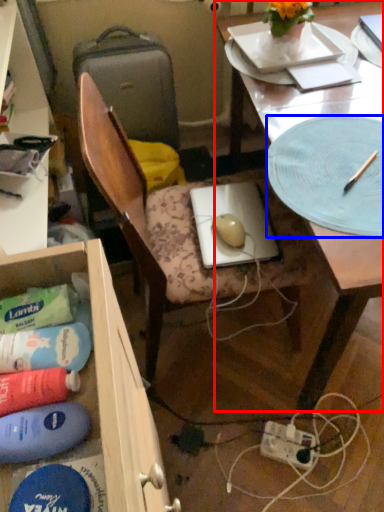
Question: Which point is closer to the camera, desk (highlighted by a red box) or platter (highlighted by a blue box)?

Choices:
 (A) desk
 (B) platter

Answer: (A)